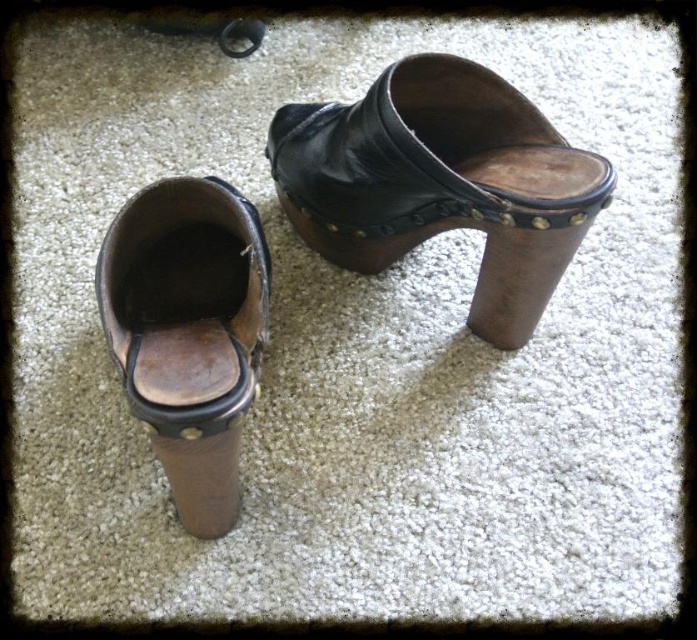
Question: Among these points, which one is nearest to the camera?

Choices:
 (A) (183, 234)
 (B) (390, 140)

Answer: (B)

Question: Which point is closer to the camera?

Choices:
 (A) (418, 218)
 (B) (190, 204)

Answer: (B)

Question: Is black leather clog at center positioned in front of brown leather clog at left?

Choices:
 (A) yes
 (B) no

Answer: (B)

Question: From the image, what is the correct spatial relationship of black leather clog at center in relation to brown leather clog at left?

Choices:
 (A) above
 (B) below

Answer: (A)

Question: Is black leather clog at center above brown leather clog at left?

Choices:
 (A) no
 (B) yes

Answer: (B)